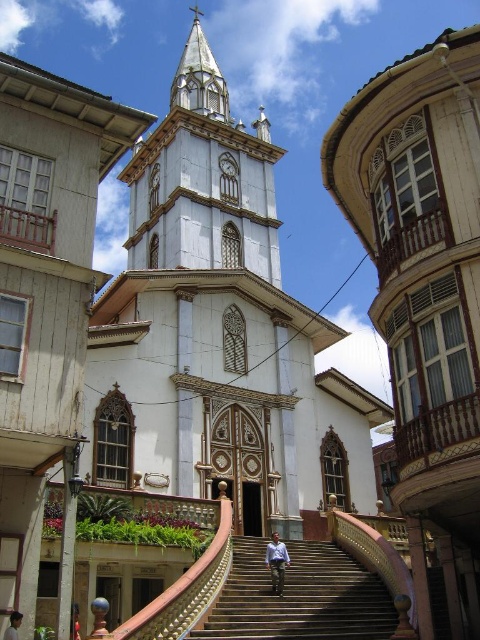
You are standing in front of the grand church and notice the dark brown wooden stairs at center and the light brown hair at lower left. Which object is taller?

The dark brown wooden stairs at center is taller than the light brown hair at lower left.